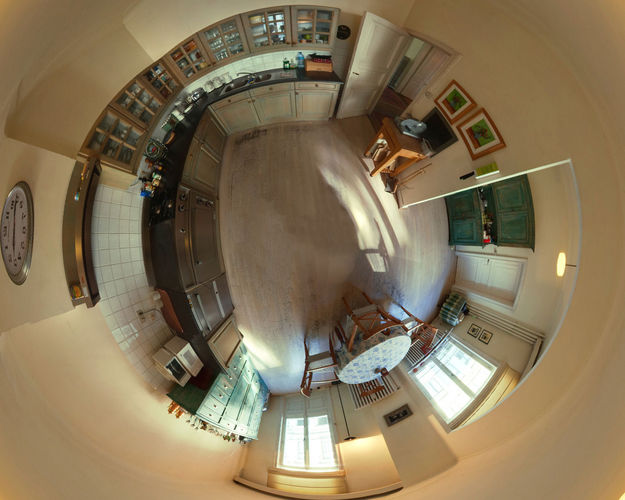
The width and height of the screenshot is (625, 500). What are the coordinates of `clock` in the screenshot? It's located at (22, 223).